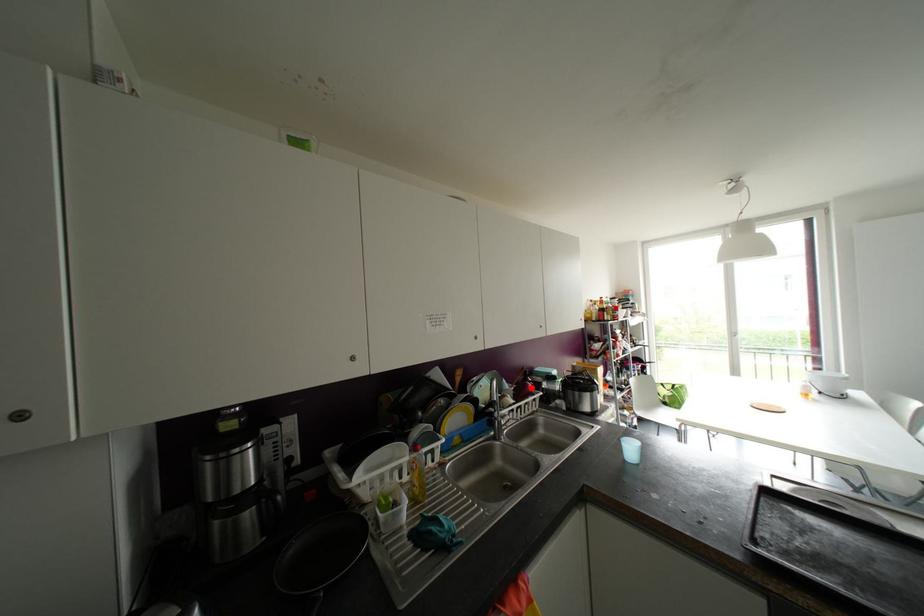
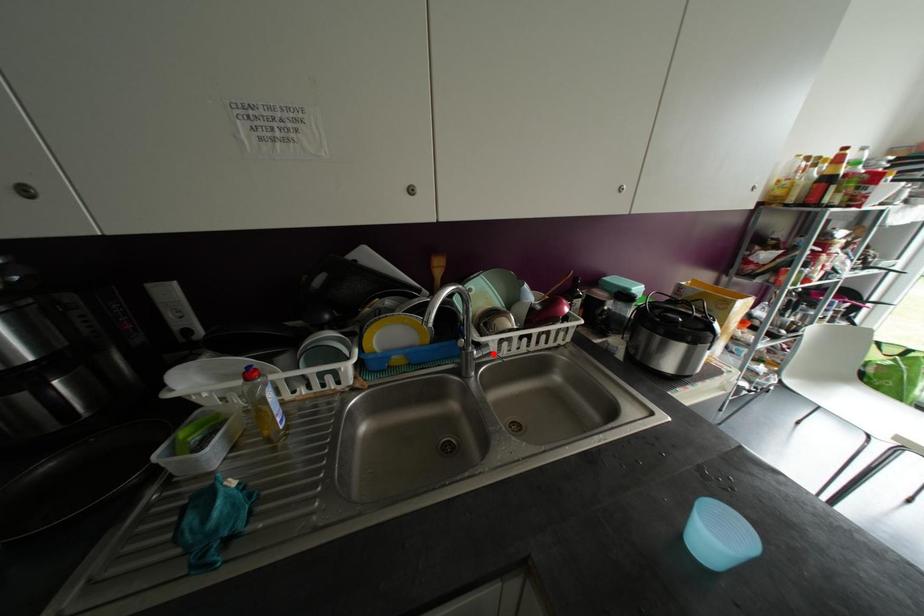
I am providing you with two images of the same scene from different viewpoints. A red point is marked on the first image and another point is marked on the second image. Are the points marked in image1 and image2 representing the same 3D position?

No